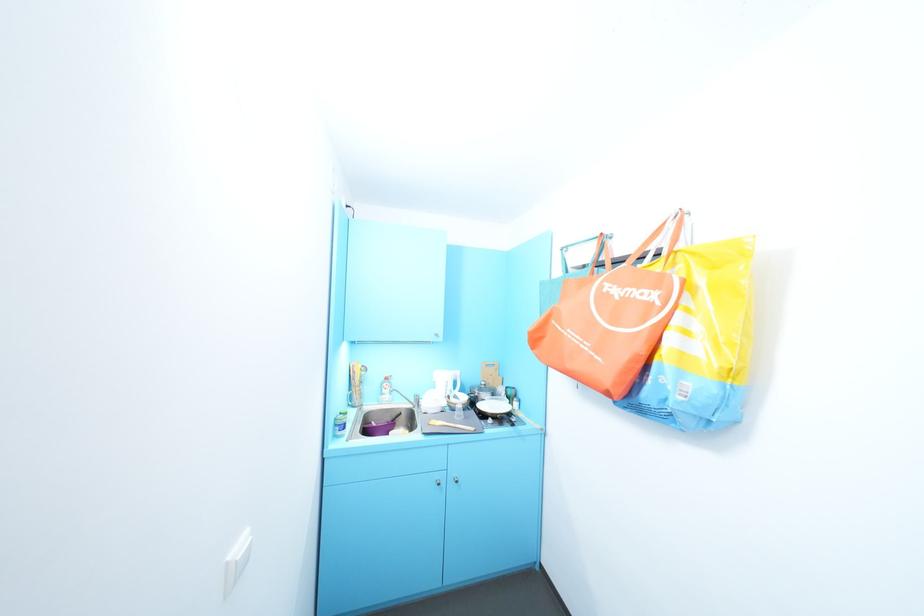
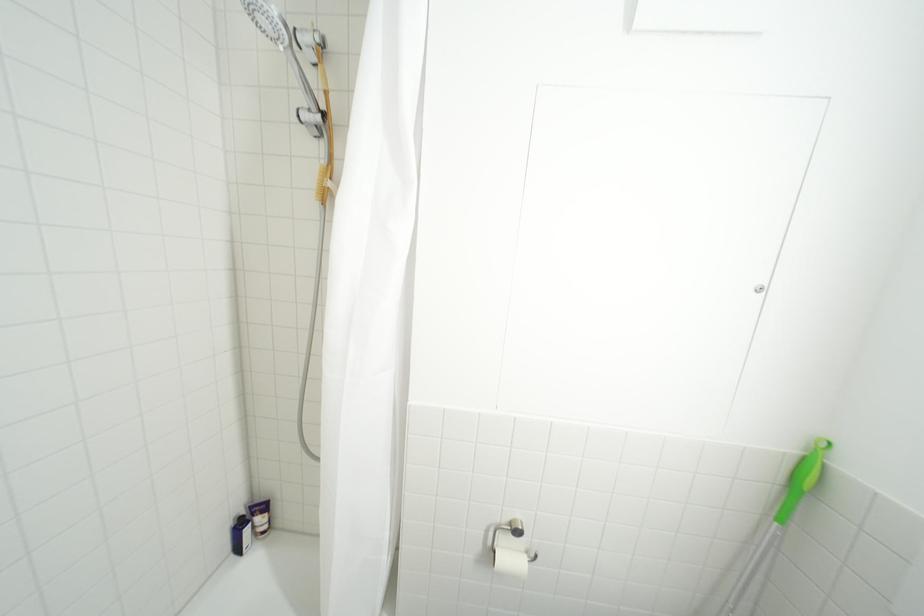
Question: What movement of the cameraman would produce the second image?

Choices:
 (A) Left
 (B) Right
 (C) Forward
 (D) Backward

Answer: (A)